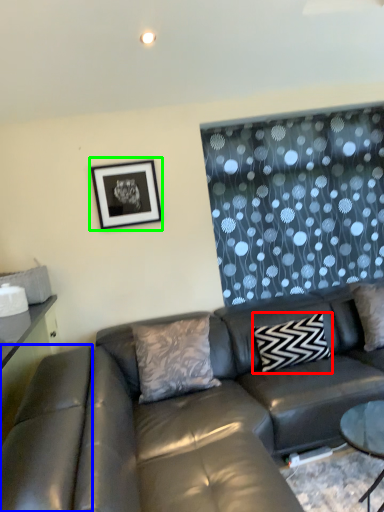
Question: Which object is positioned farthest from pillow (highlighted by a red box)? Select from swivel chair (highlighted by a blue box) and picture frame (highlighted by a green box).

Choices:
 (A) swivel chair
 (B) picture frame

Answer: (A)